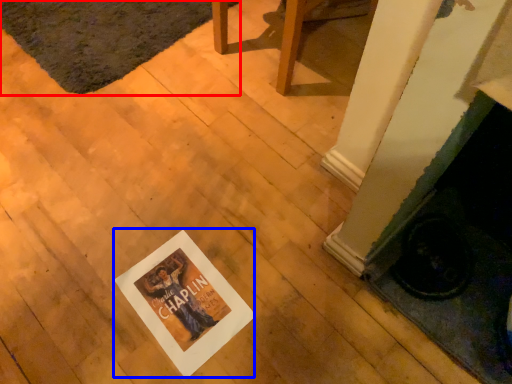
Question: Which point is closer to the camera, mat (highlighted by a red box) or postcard (highlighted by a blue box)?

Choices:
 (A) mat
 (B) postcard

Answer: (B)